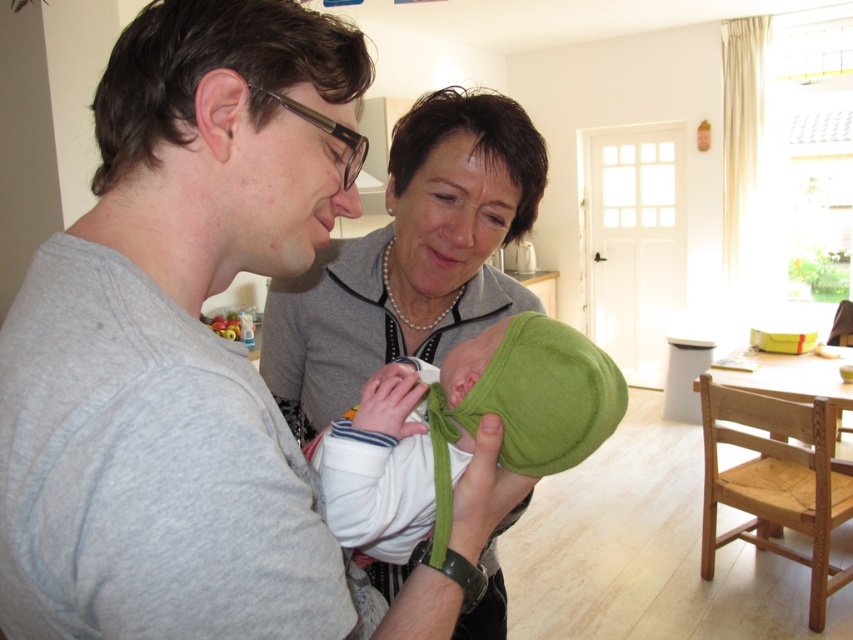
Is pearl necklace at upper center thinner than green fleece hat at center?

No, pearl necklace at upper center is not thinner than green fleece hat at center.

Between point (473, 170) and point (621, 388), which one is positioned in front?

Point (621, 388)

Between point (436, 355) and point (556, 358), which one is positioned behind?

Point (436, 355)

The width and height of the screenshot is (853, 640). I want to click on pearl necklace at upper center, so click(x=410, y=259).

From the picture: Which is more to the left, gray cotton shirt at center or green fleece hat at center?

gray cotton shirt at center

What do you see at coordinates (195, 355) in the screenshot? This screenshot has height=640, width=853. I see `gray cotton shirt at center` at bounding box center [195, 355].

This screenshot has height=640, width=853. I want to click on gray cotton shirt at center, so click(195, 355).

Who is lower down, gray cotton shirt at center or pearl necklace at upper center?

Positioned lower is gray cotton shirt at center.

Can you confirm if gray cotton shirt at center is bigger than pearl necklace at upper center?

Incorrect, gray cotton shirt at center is not larger than pearl necklace at upper center.

Between point (45, 346) and point (503, 307), which one is positioned behind?

Point (503, 307)

Locate an element on the screen. gray cotton shirt at center is located at coordinates (195, 355).